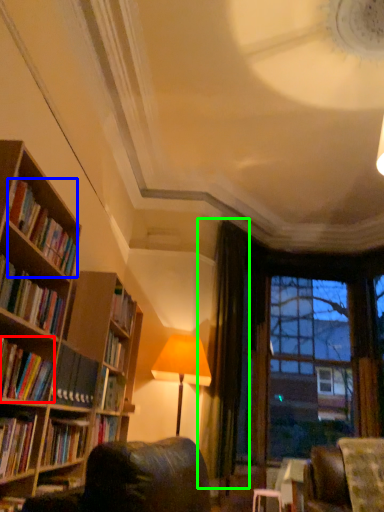
Question: Considering the real-world distances, which object is farthest from book (highlighted by a red box)? book (highlighted by a blue box) or curtain (highlighted by a green box)?

Choices:
 (A) book
 (B) curtain

Answer: (B)